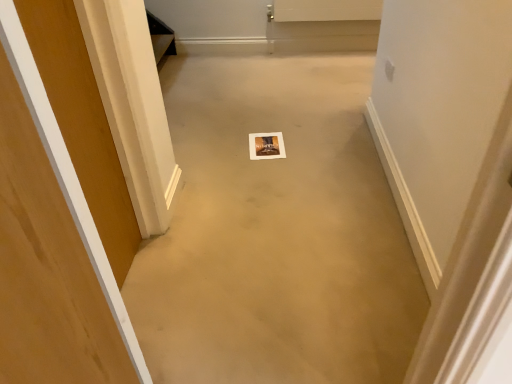
Question: Considering the positions of beige carpet at center and wooden door at left in the image, is beige carpet at center taller or shorter than wooden door at left?

Choices:
 (A) short
 (B) tall

Answer: (A)

Question: From the image's perspective, relative to wooden door at left, is beige carpet at center above or below?

Choices:
 (A) below
 (B) above

Answer: (B)

Question: From a real-world perspective, relative to wooden door at left, is beige carpet at center vertically above or below?

Choices:
 (A) below
 (B) above

Answer: (A)

Question: Visually, is wooden door at left positioned to the left or to the right of beige carpet at center?

Choices:
 (A) left
 (B) right

Answer: (A)

Question: From a real-world perspective, is wooden door at left above or below beige carpet at center?

Choices:
 (A) below
 (B) above

Answer: (B)

Question: Considering their positions, is wooden door at left located in front of or behind beige carpet at center?

Choices:
 (A) behind
 (B) front

Answer: (B)

Question: From the image's perspective, is wooden door at left above or below beige carpet at center?

Choices:
 (A) above
 (B) below

Answer: (B)